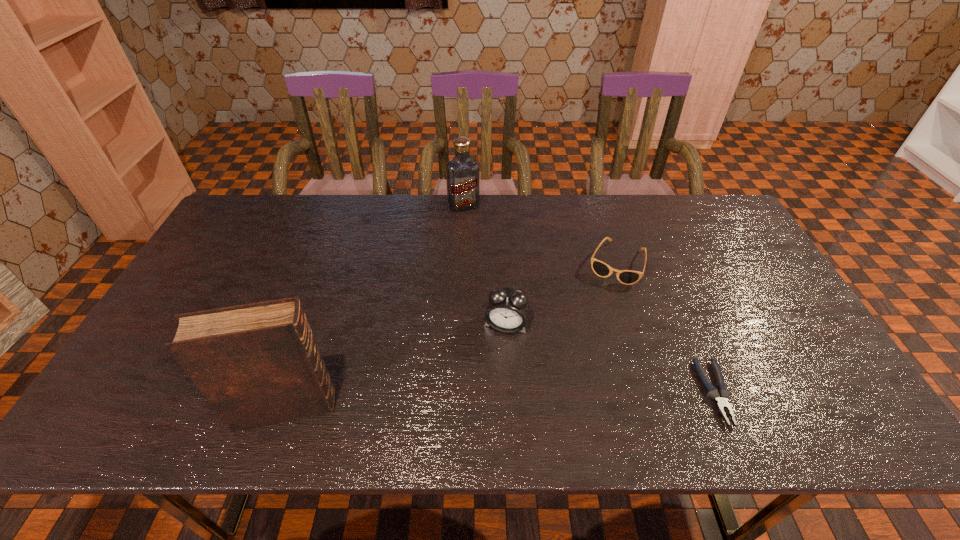
The image size is (960, 540). In order to click on free space located on the back of the tallest object in this screenshot , I will do `click(329, 281)`.

The width and height of the screenshot is (960, 540). In order to click on vacant space located 0.290m on the front-facing side of the fourth object from left to right in this screenshot , I will do `click(580, 359)`.

Identify the location of vacant area located on the front-facing side of the fourth object from left to right. (588, 338).

What are the coordinates of `vacant space situated 0.360m on the front-facing side of the fourth object from left to right` in the screenshot? It's located at pyautogui.click(x=571, y=381).

Identify the location of free space located on the front-facing side of the vodka. (471, 226).

The image size is (960, 540). I want to click on vacant area situated on the front-facing side of the vodka, so click(474, 233).

This screenshot has width=960, height=540. Identify the location of free region located on the front-facing side of the vodka. (470, 222).

Where is `vacant space positioned 0.060m on the front side of the third farthest object`? vacant space positioned 0.060m on the front side of the third farthest object is located at coordinates (499, 356).

This screenshot has height=540, width=960. In order to click on object that is at the far edge in this screenshot , I will do `click(462, 171)`.

Locate an element on the screen. The image size is (960, 540). Bible present at the near edge is located at coordinates (257, 364).